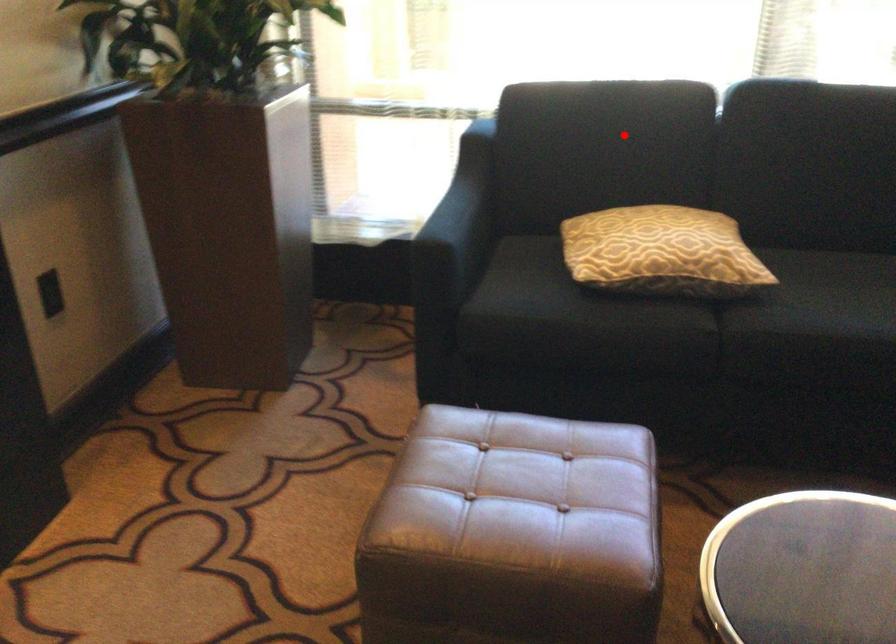
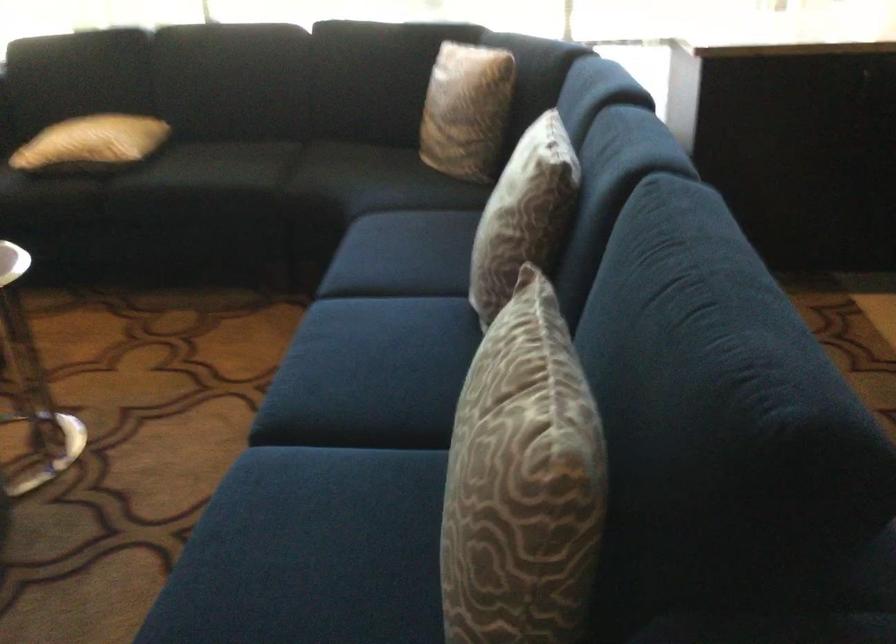
Locate, in the second image, the point that corresponds to the highlighted location in the first image.

(82, 64)